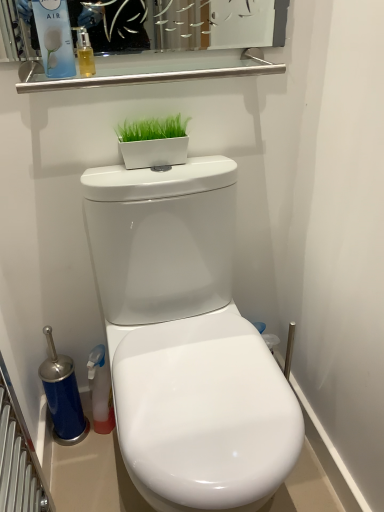
Question: Is point (137, 474) closer or farther from the camera than point (162, 152)?

Choices:
 (A) closer
 (B) farther

Answer: (A)

Question: Looking at their shapes, would you say white glossy toilet at center is wider or thinner than white glossy flowerpot at upper center?

Choices:
 (A) wide
 (B) thin

Answer: (A)

Question: Which of these objects is positioned closest to the translucent amber liquid at upper left?

Choices:
 (A) white glossy flowerpot at upper center
 (B) satin nickel bar at upper center
 (C) white glossy toilet at center
 (D) matte blue air freshener at upper left

Answer: (D)

Question: Estimate the real-world distances between objects in this image. Which object is farther from the translucent amber liquid at upper left?

Choices:
 (A) white glossy toilet at center
 (B) white glossy flowerpot at upper center
 (C) matte blue air freshener at upper left
 (D) satin nickel bar at upper center

Answer: (A)